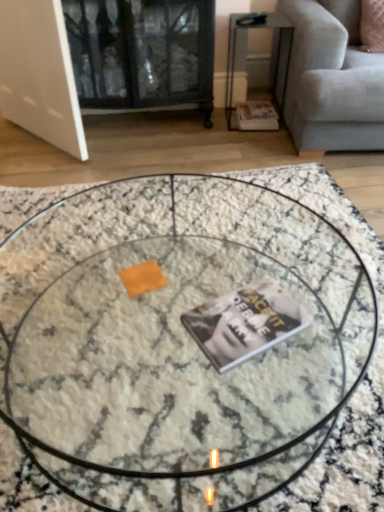
This screenshot has width=384, height=512. I want to click on vacant area on the back side of hardcover book at center, arranged as the second magazine when viewed from the right, so click(233, 269).